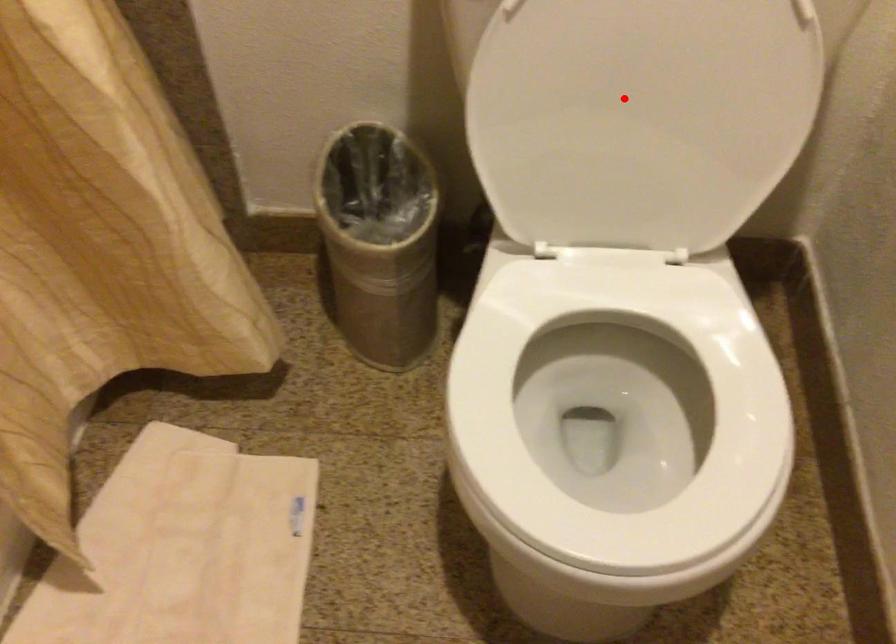
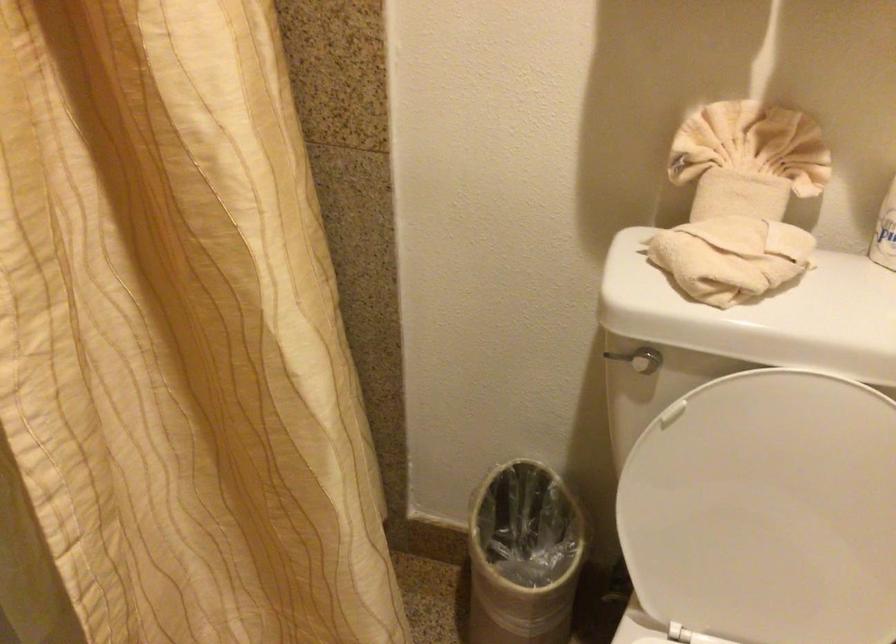
Find the pixel in the second image that matches the highlighted location in the first image.

(767, 511)